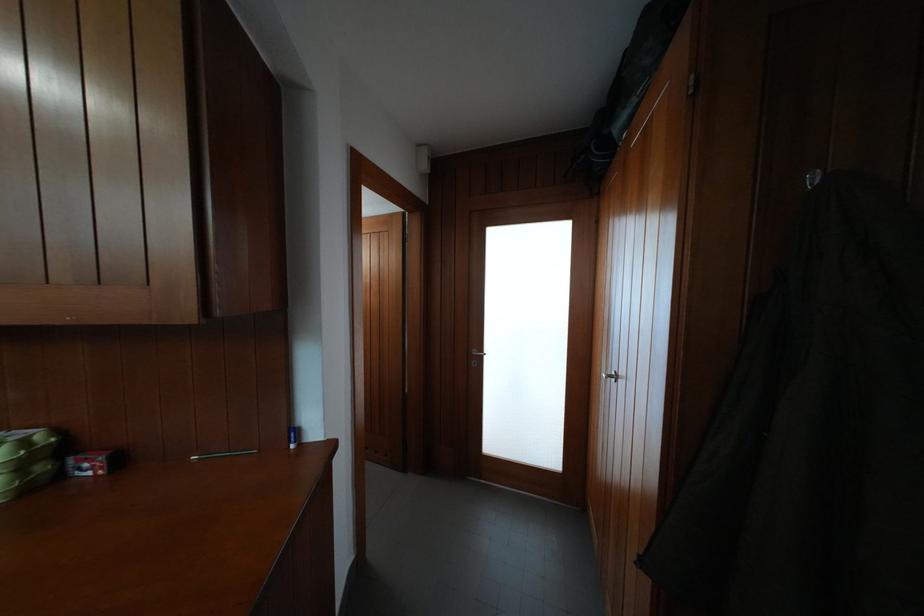
This screenshot has height=616, width=924. In order to click on green pencil in this screenshot , I will do `click(223, 454)`.